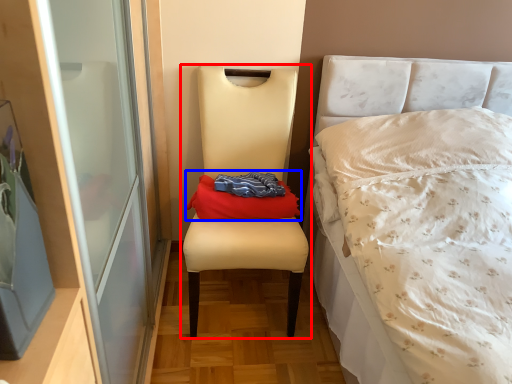
Question: Among these objects, which one is nearest to the camera, chair (highlighted by a red box) or throw pillow (highlighted by a blue box)?

Choices:
 (A) chair
 (B) throw pillow

Answer: (A)